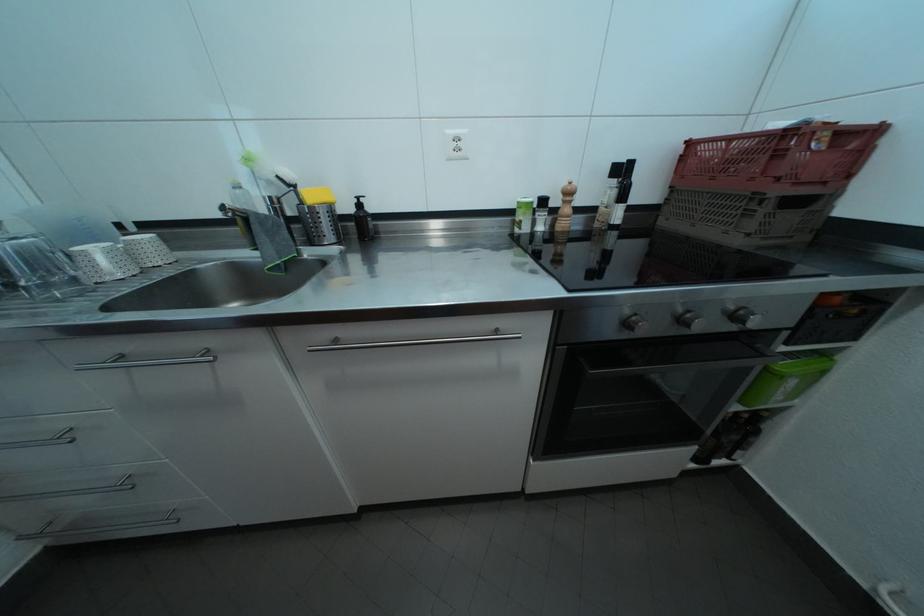
The width and height of the screenshot is (924, 616). Describe the element at coordinates (359, 197) in the screenshot. I see `the soap dispenser pump` at that location.